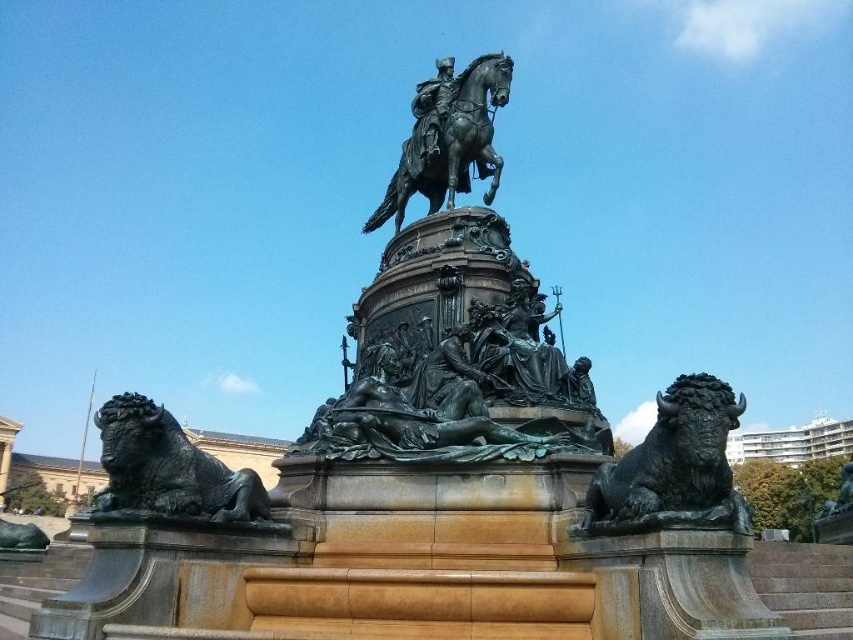
Question: Is polished bronze horse at center to the right of polished bronze statue at center from the viewer's perspective?

Choices:
 (A) no
 (B) yes

Answer: (B)

Question: Which of the following is the closest to the observer?

Choices:
 (A) (421, 150)
 (B) (102, 420)
 (C) (436, 144)

Answer: (B)

Question: Among these points, which one is farthest from the camera?

Choices:
 (A) (479, 156)
 (B) (415, 99)

Answer: (B)

Question: Does bronze/statue at lower left have a smaller size compared to polished bronze statue at center?

Choices:
 (A) no
 (B) yes

Answer: (A)

Question: Does bronze/statue at lower left appear on the left side of polished bronze statue at center?

Choices:
 (A) yes
 (B) no

Answer: (A)

Question: Which object is the closest to the bronze/statue at lower left?

Choices:
 (A) bronze textured bison at lower right
 (B) polished bronze horse at center
 (C) polished bronze statue at center

Answer: (A)